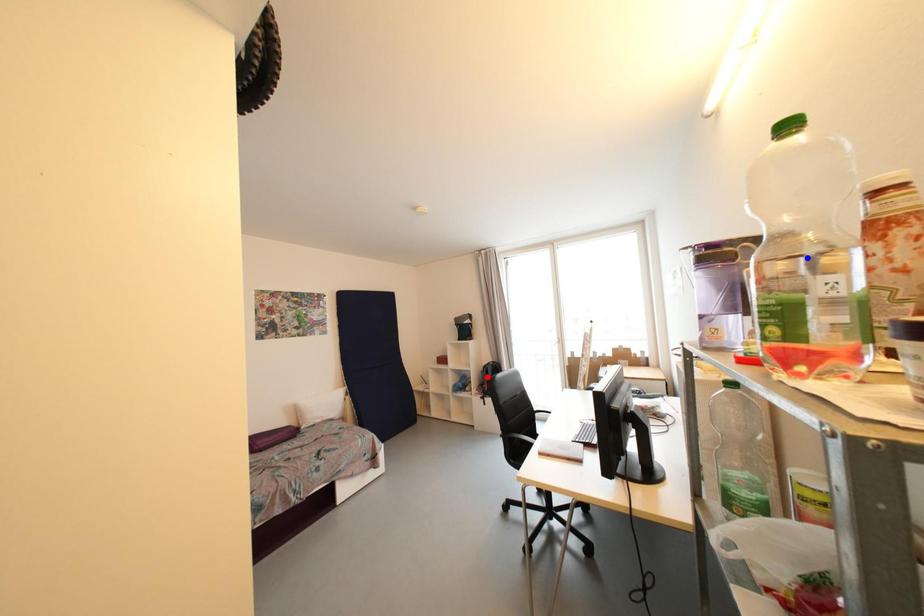
Question: Two points are marked on the image. Which point is closer to the camera?

Choices:
 (A) Blue point is closer.
 (B) Red point is closer.

Answer: (A)